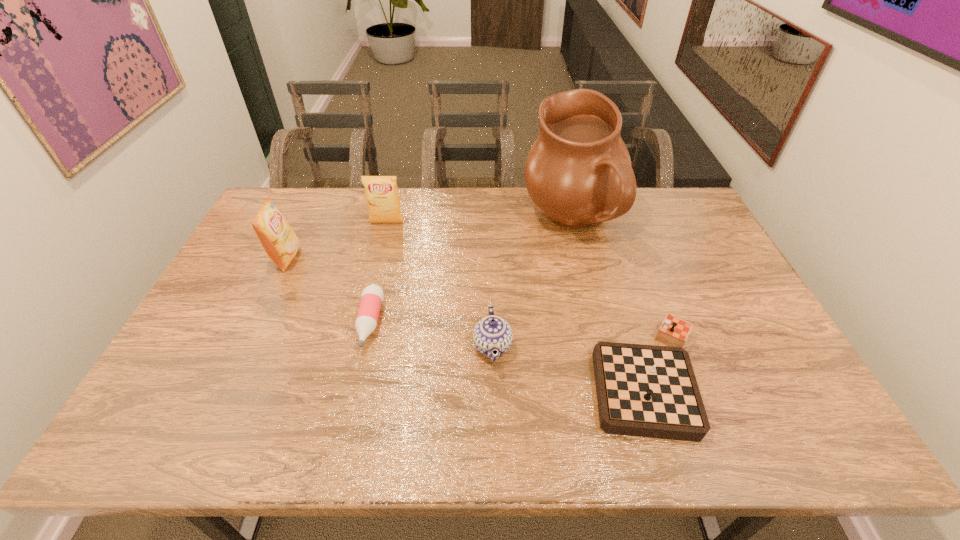
At what (x,y) coordinates should I click in order to perform the action: click on free spot located 0.290m at the spout of the cream pitcher. Please return your answer as a coordinate pair (x, y). The height and width of the screenshot is (540, 960). Looking at the image, I should click on (440, 222).

Identify the location of free location located on the front-facing side of the leftmost object. (322, 258).

Image resolution: width=960 pixels, height=540 pixels. Identify the location of vacant space situated on the front of the farther crisp (potato chip) with the logo. (379, 253).

Where is `vacant space located 0.140m at the spout of the chinaware`? This screenshot has width=960, height=540. vacant space located 0.140m at the spout of the chinaware is located at coordinates (420, 346).

Find the location of `blank area located at the spout of the chinaware`. blank area located at the spout of the chinaware is located at coordinates [x=335, y=346].

Locate an element on the screen. The image size is (960, 540). vacant region located 0.280m at the spout of the chinaware is located at coordinates (366, 346).

Locate an element on the screen. free location located 0.250m on the back of the fifth tallest object is located at coordinates (612, 262).

This screenshot has height=540, width=960. Find the location of `vacant region located 0.160m with the cap open on the shortest object`. vacant region located 0.160m with the cap open on the shortest object is located at coordinates (349, 410).

I want to click on cream pitcher that is at the far edge, so click(x=578, y=171).

Locate an element on the screen. This screenshot has width=960, height=540. crisp (potato chip) present at the far edge is located at coordinates (381, 192).